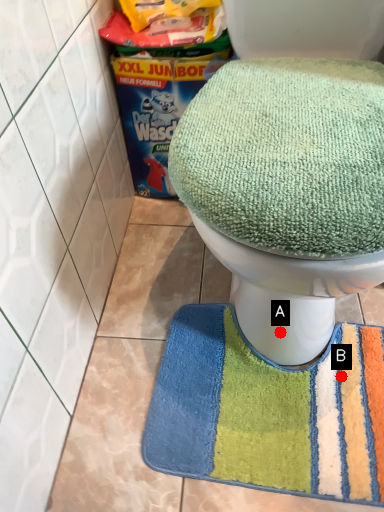
Question: Two points are circled on the image, labeled by A and B beside each circle. Which point is closer to the camera?

Choices:
 (A) A is closer
 (B) B is closer

Answer: (A)